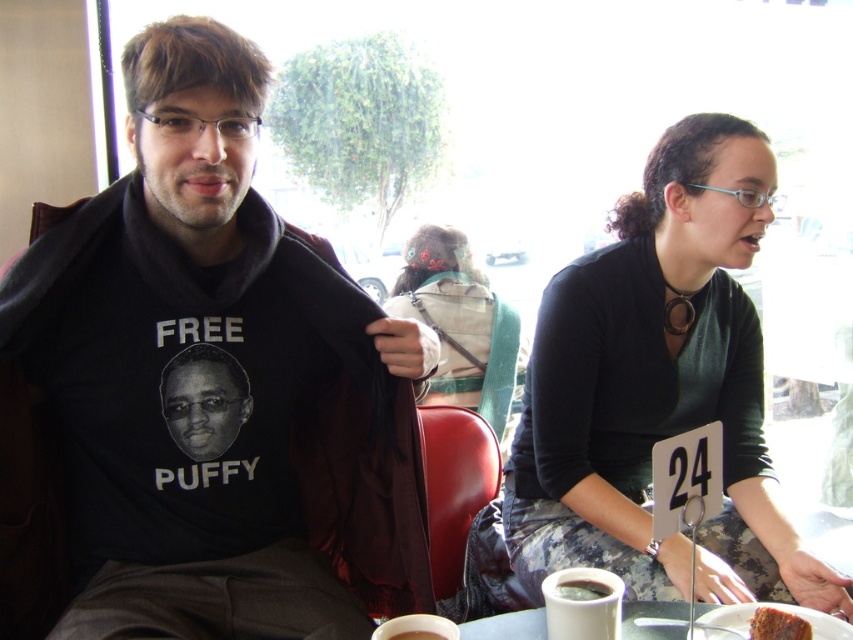
Question: Which point appears farthest from the camera in this image?

Choices:
 (A) (567, 573)
 (B) (671, 602)

Answer: (B)

Question: Considering the relative positions of white ceramic cup at lower center and white ceramic mug at lower center in the image provided, where is white ceramic cup at lower center located with respect to white ceramic mug at lower center?

Choices:
 (A) below
 (B) above

Answer: (A)

Question: Is black matte hoodie at left positioned in front of white ceramic plate at lower center?

Choices:
 (A) no
 (B) yes

Answer: (B)

Question: Which object is closer to the camera taking this photo?

Choices:
 (A) white ceramic plate at lower center
 (B) matte green blouse at center

Answer: (A)

Question: From the image, what is the correct spatial relationship of matte green blouse at center in relation to brown crumbly cake at lower right?

Choices:
 (A) above
 (B) below

Answer: (A)

Question: Which object appears closest to the camera in this image?

Choices:
 (A) white ceramic cup at lower center
 (B) black matte cup at lower center

Answer: (A)